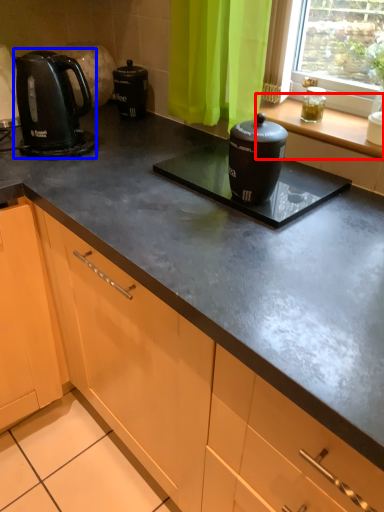
Question: Which object is closer to the camera taking this photo, window sill (highlighted by a red box) or kitchen appliance (highlighted by a blue box)?

Choices:
 (A) window sill
 (B) kitchen appliance

Answer: (A)